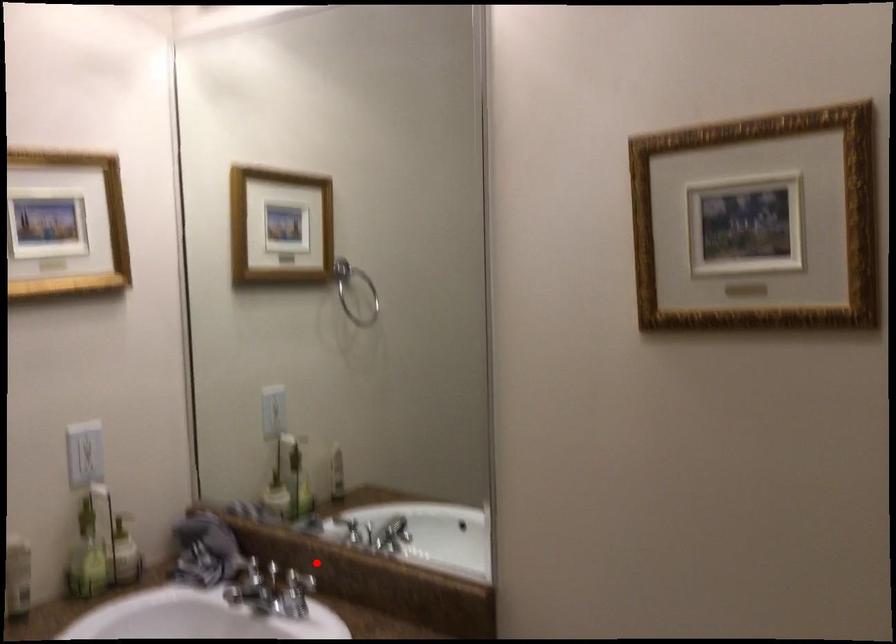
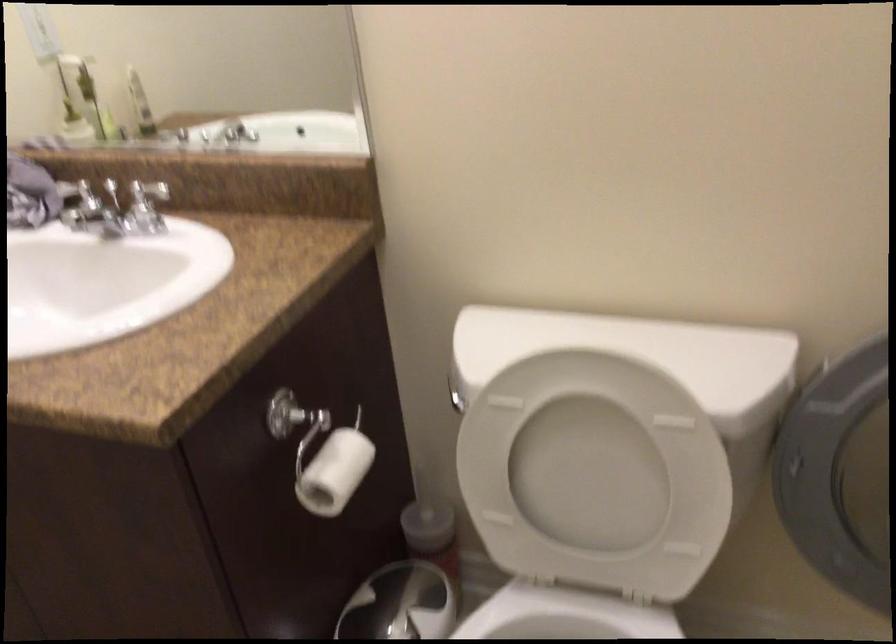
The point at the highlighted location is marked in the first image. Where is the corresponding point in the second image?

(156, 182)